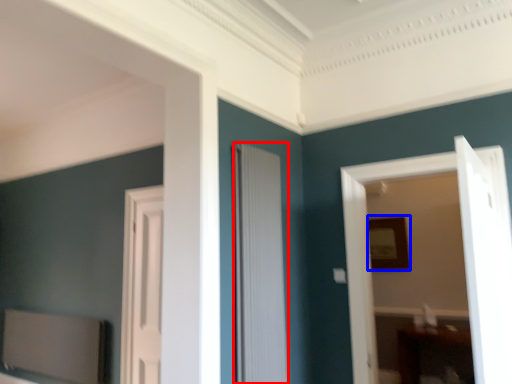
Question: Which object appears closest to the camera in this image, door (highlighted by a red box) or picture frame (highlighted by a blue box)?

Choices:
 (A) door
 (B) picture frame

Answer: (A)